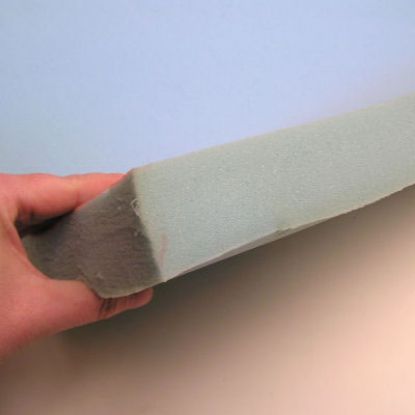
Find the location of a particular element. The width and height of the screenshot is (415, 415). wall is located at coordinates (282, 374).